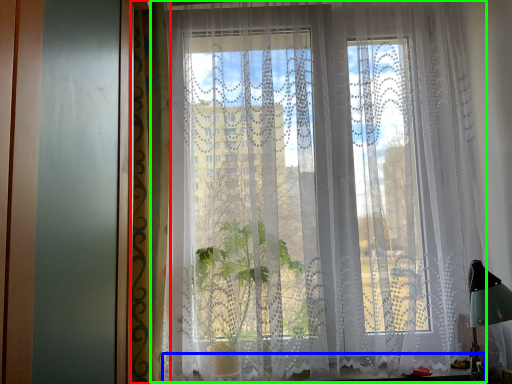
Question: Considering the real-world distances, which object is farthest from curtain (highlighted by a red box)? window sill (highlighted by a blue box) or curtain (highlighted by a green box)?

Choices:
 (A) window sill
 (B) curtain

Answer: (A)